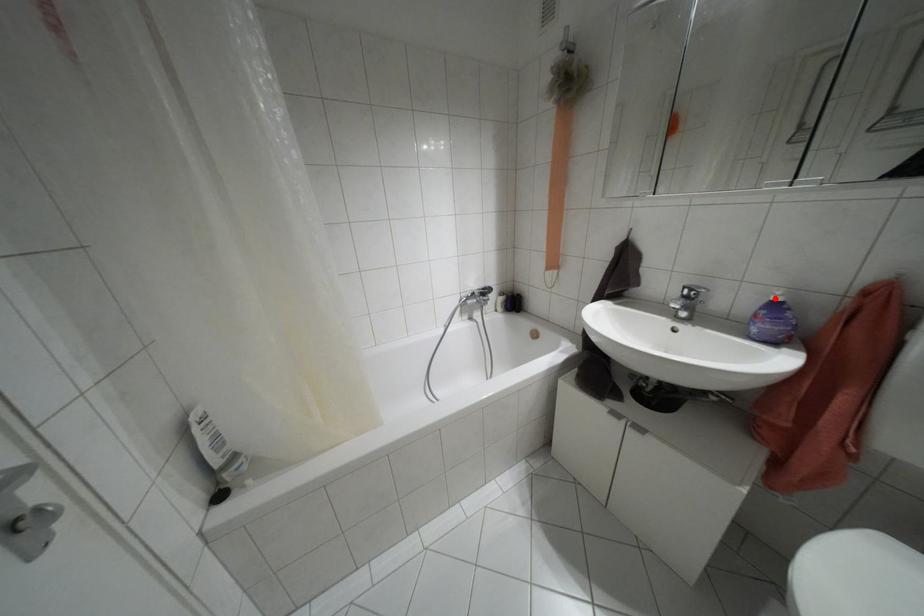
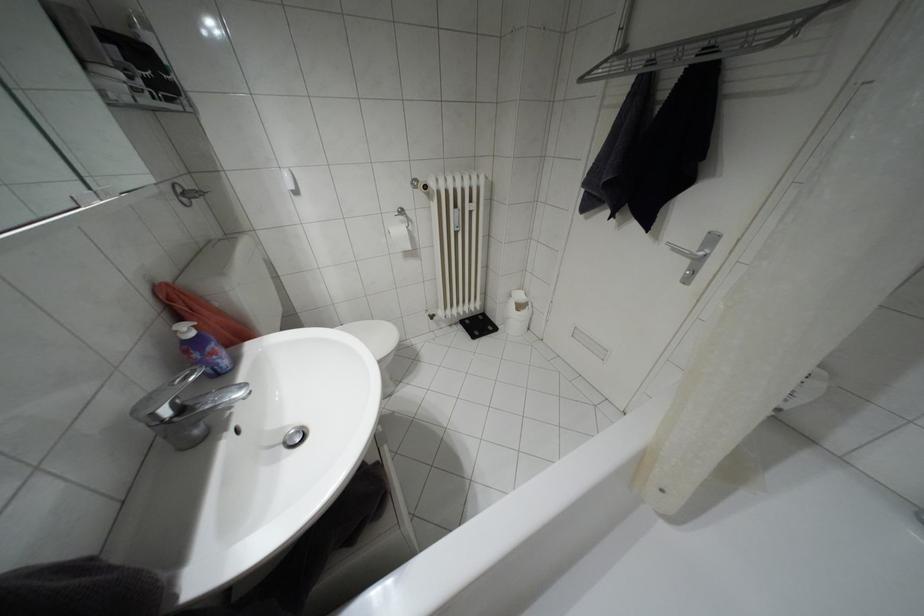
Question: I am providing you with two images of the same scene from different viewpoints. A red point is shown in image1. For the corresponding object point in image2, is it positioned nearer or farther from the camera?

Choices:
 (A) Nearer
 (B) Farther

Answer: (A)